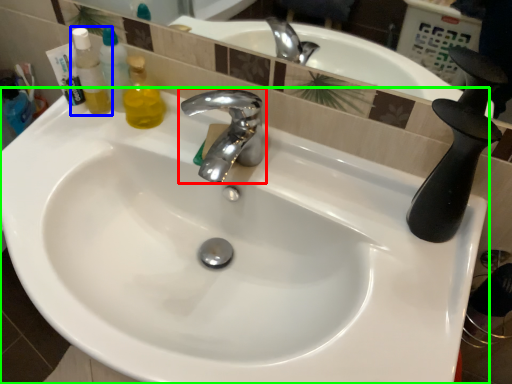
Question: Considering the real-world distances, which object is farthest from tap (highlighted by a red box)? mouthwash (highlighted by a blue box) or sink (highlighted by a green box)?

Choices:
 (A) mouthwash
 (B) sink

Answer: (A)